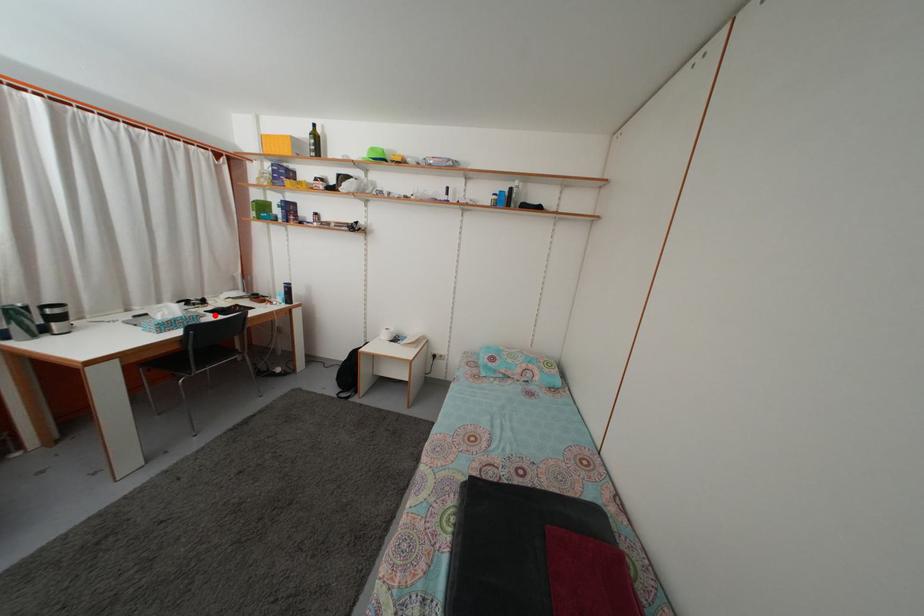
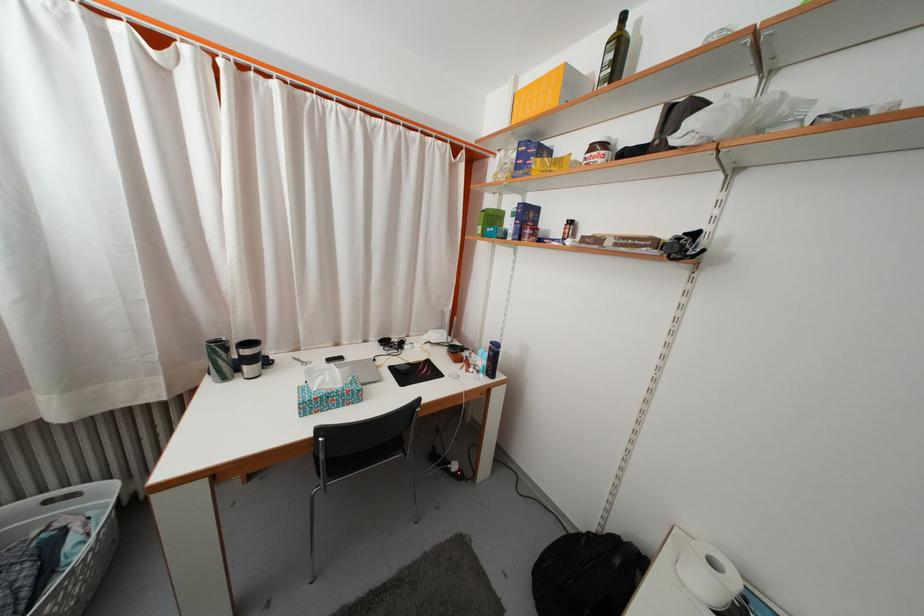
Locate, in the second image, the point that corresponds to the highlighted location in the first image.

(402, 369)